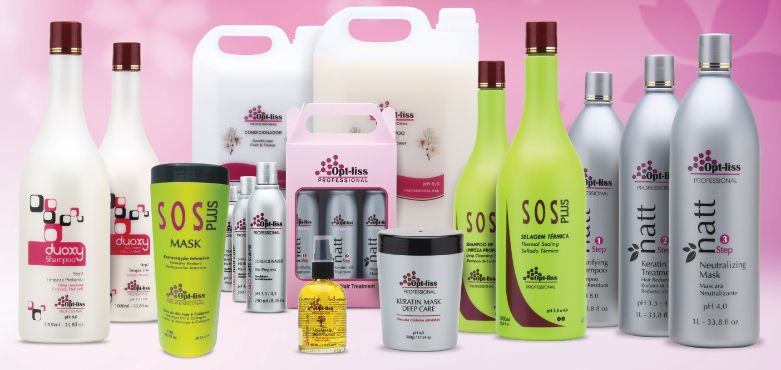
Where is `4 color green bottles`? The image size is (781, 370). 4 color green bottles is located at coordinates (561, 222), (462, 193), (173, 253), (327, 318).